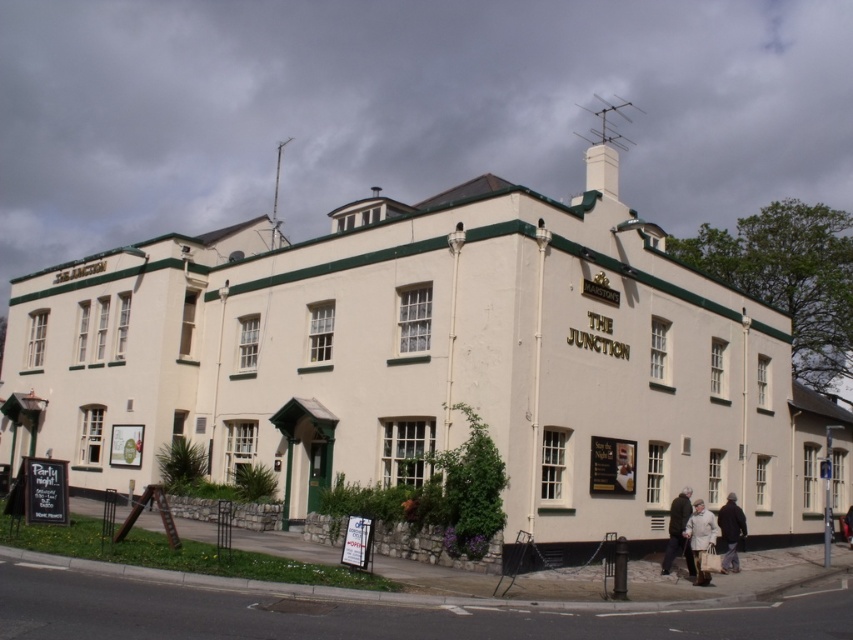
Question: Is white painted building at center bigger than dark gray jacket at lower right?

Choices:
 (A) no
 (B) yes

Answer: (B)

Question: Does white painted building at center appear over dark gray jacket at lower right?

Choices:
 (A) no
 (B) yes

Answer: (B)

Question: Which point appears farthest from the camera in this image?

Choices:
 (A) (737, 529)
 (B) (704, 525)
 (C) (469, 307)
 (D) (677, 513)

Answer: (A)

Question: Which point is closer to the camera taking this photo?

Choices:
 (A) (701, 522)
 (B) (682, 488)

Answer: (A)

Question: Which point is farther to the camera?

Choices:
 (A) (260, 355)
 (B) (741, 532)

Answer: (A)

Question: Where is white wool coat at lower right located in relation to dark brown leather coat at lower right in the image?

Choices:
 (A) right
 (B) left

Answer: (A)